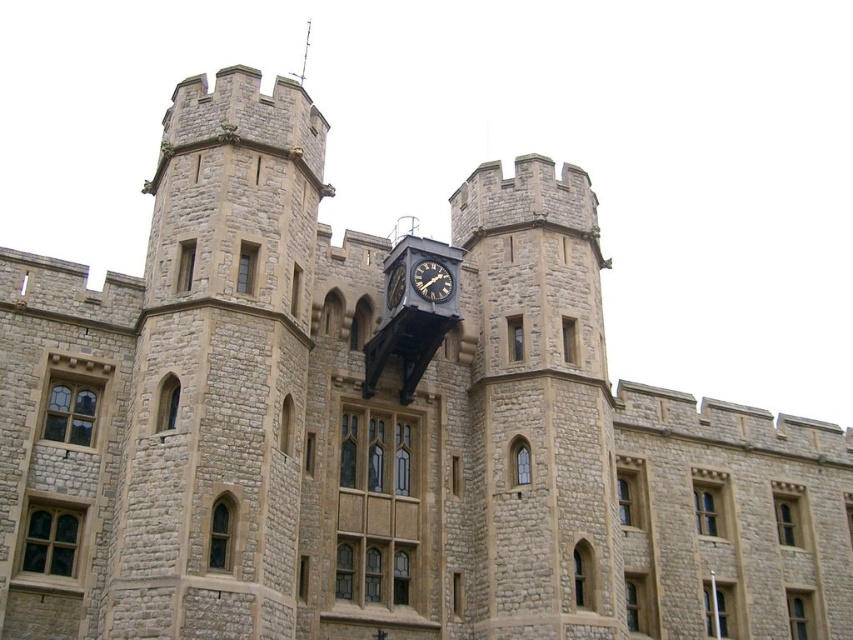
Between point (419, 292) and point (396, 288), which one is positioned behind?

Point (396, 288)

Consider the image. Can you confirm if black metal clock at center is shorter than gold metallic clock at center?

Yes, black metal clock at center is shorter than gold metallic clock at center.

I want to click on black metal clock at center, so click(432, 280).

The width and height of the screenshot is (853, 640). Identify the location of black metal clock at center. (432, 280).